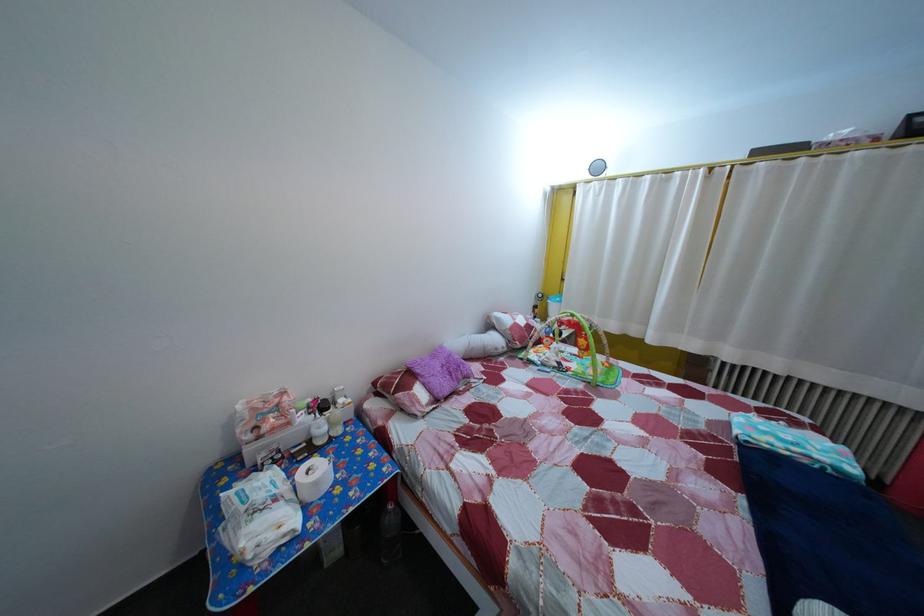
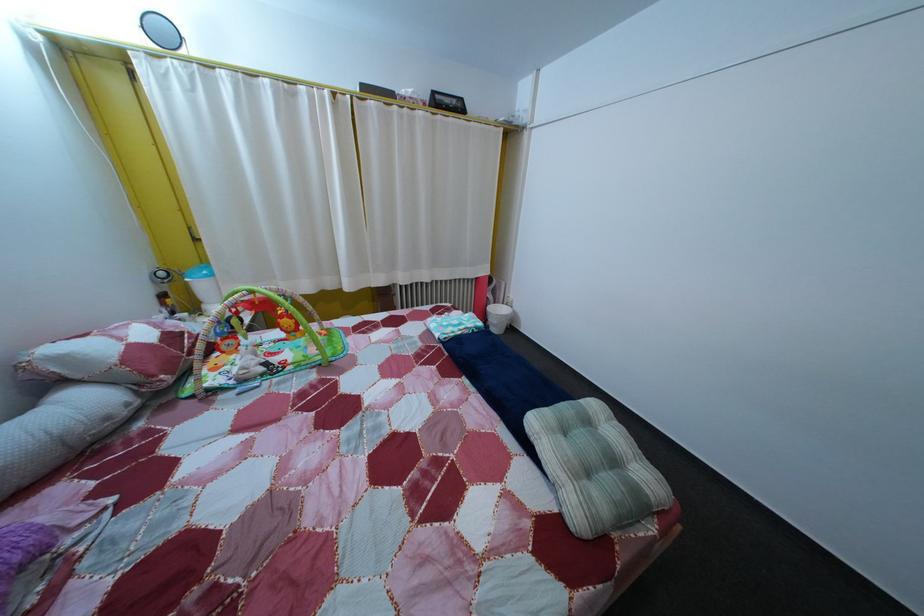
The images are taken continuously from a first-person perspective. In which direction is your viewpoint rotating?

The camera's rotation is toward right-down.